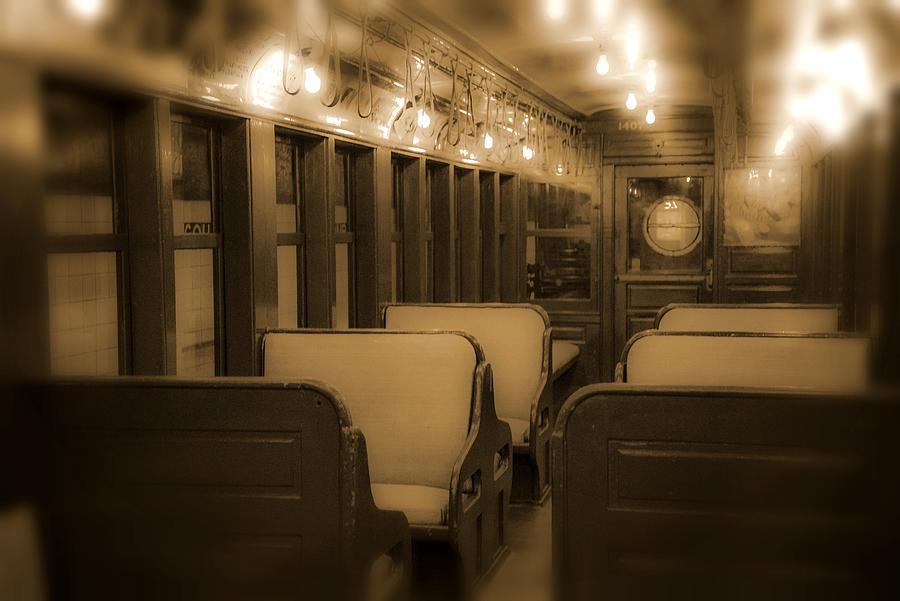
Find the location of a particular element. The height and width of the screenshot is (601, 900). bench cushions is located at coordinates (412, 496), (509, 365), (689, 362), (718, 316).